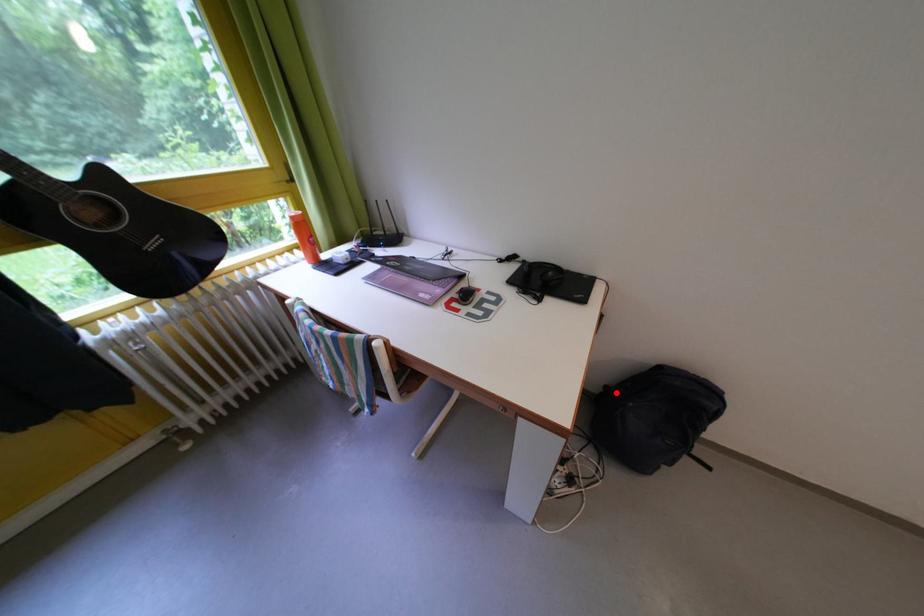
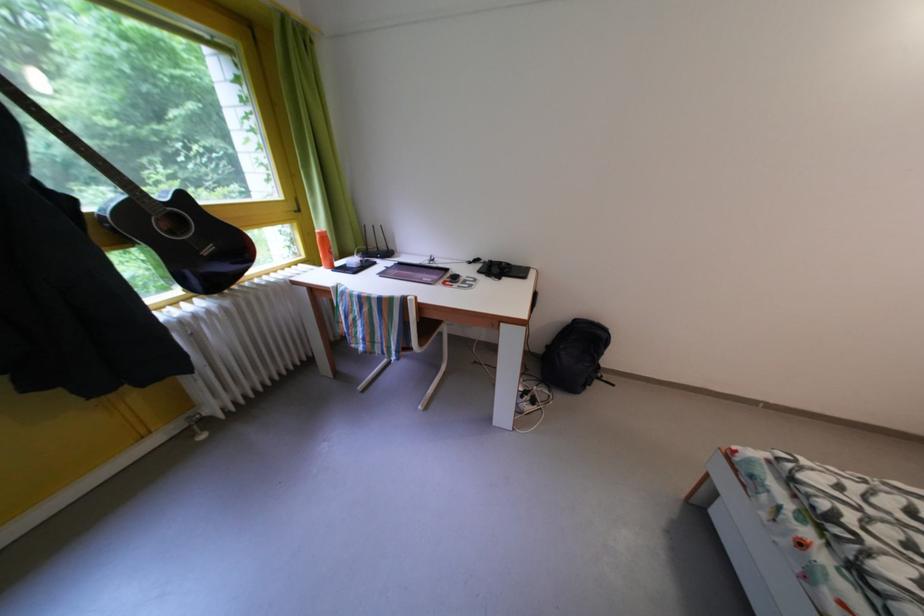
Find the pixel in the second image that matches the highlighted location in the first image.

(556, 353)